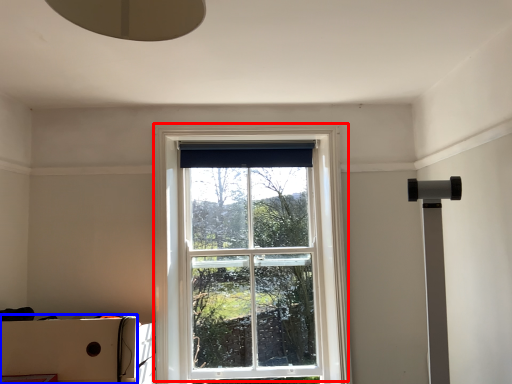
Question: Which object is further to the camera taking this photo, window (highlighted by a red box) or cardboard box (highlighted by a blue box)?

Choices:
 (A) window
 (B) cardboard box

Answer: (A)